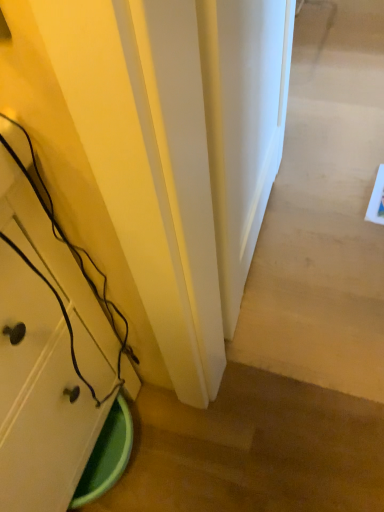
Question: Is white smooth door at center bigger or smaller than matte white cabinet at lower left?

Choices:
 (A) big
 (B) small

Answer: (B)

Question: Choose the correct answer: Is white smooth door at center inside matte white cabinet at lower left or outside it?

Choices:
 (A) inside
 (B) outside

Answer: (B)

Question: From the image's perspective, relative to matte white cabinet at lower left, is white smooth door at center above or below?

Choices:
 (A) above
 (B) below

Answer: (A)

Question: In terms of height, does matte white cabinet at lower left look taller or shorter compared to white smooth door at center?

Choices:
 (A) short
 (B) tall

Answer: (A)

Question: From the image's perspective, is matte white cabinet at lower left located above or below white smooth door at center?

Choices:
 (A) below
 (B) above

Answer: (A)

Question: Looking at their shapes, would you say matte white cabinet at lower left is wider or thinner than white smooth door at center?

Choices:
 (A) thin
 (B) wide

Answer: (B)

Question: Is matte white cabinet at lower left to the left or to the right of white smooth door at center in the image?

Choices:
 (A) right
 (B) left

Answer: (B)